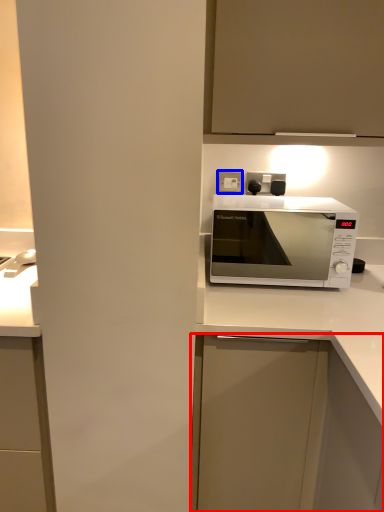
Question: Which point is further to the camera, cabinetry (highlighted by a red box) or electric outlet (highlighted by a blue box)?

Choices:
 (A) cabinetry
 (B) electric outlet

Answer: (B)